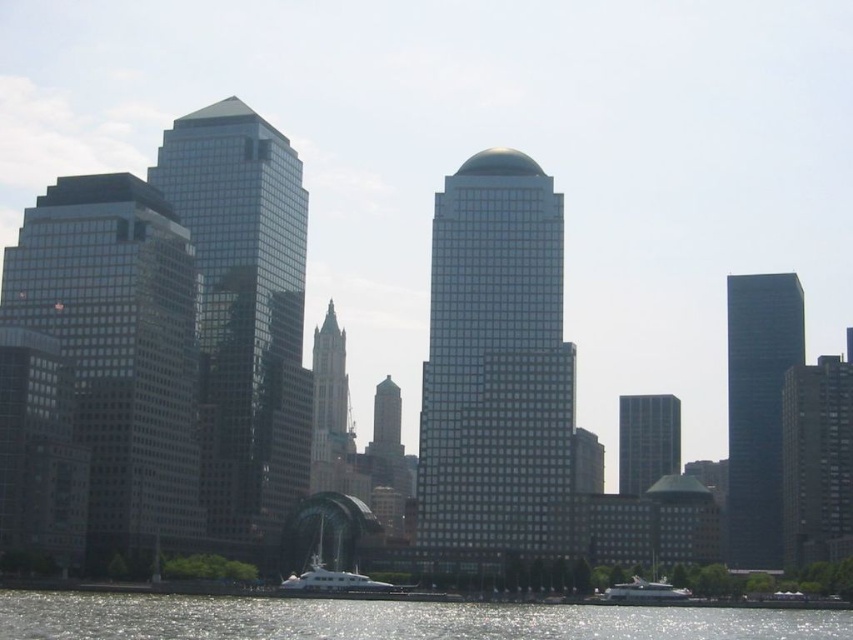
Question: Estimate the real-world distances between objects in this image. Which object is farther from the shiny dark glass skyscraper at right?

Choices:
 (A) matte glass skyscraper at left
 (B) white glossy yacht at lower center
 (C) shiny glass skyscraper at center
 (D) smooth glass skyscraper at right

Answer: (B)

Question: Which object appears farthest from the camera in this image?

Choices:
 (A) white glossy boat at lower center
 (B) shiny dark glass skyscraper at right
 (C) glassy steel skyscraper at center

Answer: (B)

Question: Which point is closer to the camera?

Choices:
 (A) smooth glass skyscraper at right
 (B) glassy steel skyscraper at center

Answer: (B)

Question: Is shiny dark glass skyscraper at right below white glossy yacht at lower center?

Choices:
 (A) no
 (B) yes

Answer: (A)

Question: Does shiny glass skyscraper at center have a larger size compared to dark gray glass building at right?

Choices:
 (A) no
 (B) yes

Answer: (B)

Question: Can you confirm if shiny dark glass skyscraper at right is thinner than white glossy boat at lower center?

Choices:
 (A) yes
 (B) no

Answer: (B)